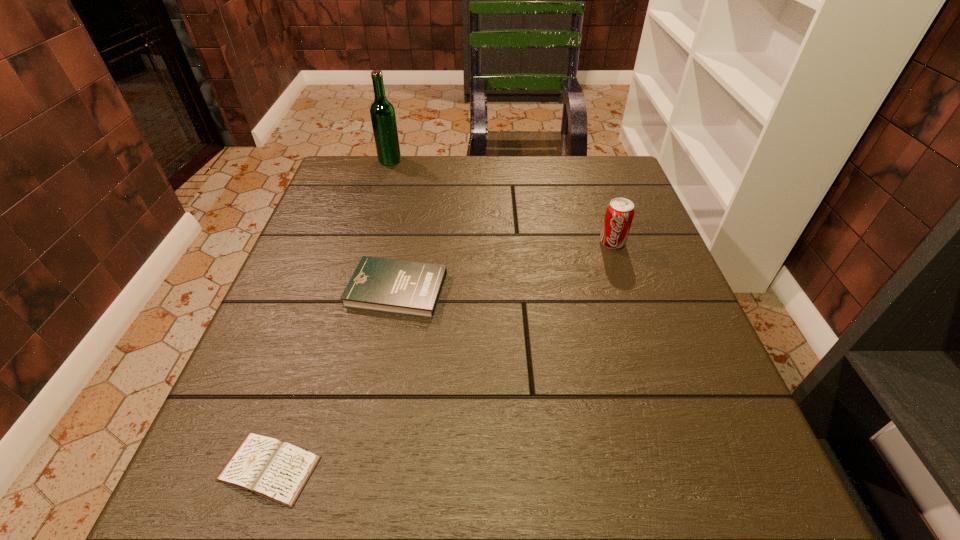
Find the location of `free space at the far edge of the desktop`. free space at the far edge of the desktop is located at coordinates (432, 170).

In the image, there is a desktop. Where is `free space at the near edge`? free space at the near edge is located at coordinates (368, 483).

Identify the location of vacant space at the left edge. This screenshot has height=540, width=960. (302, 442).

You are a GUI agent. You are given a task and a screenshot of the screen. Output one action in this format:
    pyautogui.click(x=<x>, y=<y>)
    Task: Click on the vacant space at the right edge of the desktop
    The image size is (960, 540).
    Given the screenshot: What is the action you would take?
    pyautogui.click(x=695, y=361)

In the image, there is a desktop. Where is `free space at the far left corner`? free space at the far left corner is located at coordinates pos(327,190).

In the image, there is a desktop. In order to click on vacant space at the far right corner in this screenshot , I will do pos(604,158).

The height and width of the screenshot is (540, 960). I want to click on free spot between the shortest object and the tallest object, so click(x=329, y=314).

Where is `unoccupied area between the third nearest object and the diary`? This screenshot has width=960, height=540. unoccupied area between the third nearest object and the diary is located at coordinates (441, 355).

Find the location of a particular element. empty space that is in between the nearest object and the tallest object is located at coordinates (329, 314).

Locate an element on the screen. The image size is (960, 540). vacant space that's between the farthest object and the third farthest object is located at coordinates (394, 225).